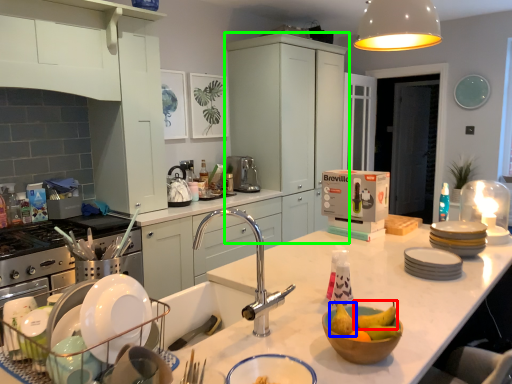
Question: Which object is positioned farthest from fruit (highlighted by a red box)? Select from fruit (highlighted by a blue box) and cabinetry (highlighted by a green box).

Choices:
 (A) fruit
 (B) cabinetry

Answer: (B)